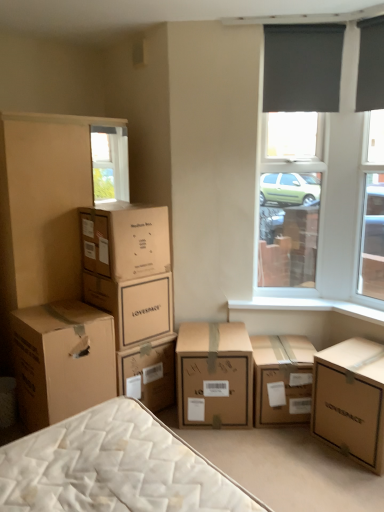
The height and width of the screenshot is (512, 384). What are the coordinates of `free space above brown cardboard box at center, positioned as the fourth box in left-to-right order (from a real-world perspective)` in the screenshot? It's located at (211, 334).